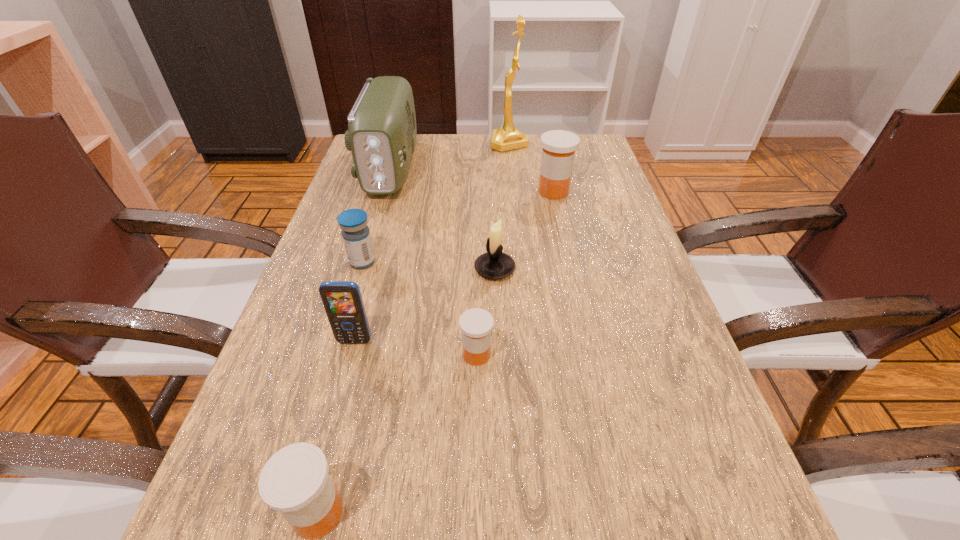
The image size is (960, 540). Identify the location of vacant space located on the label of the smallest orange medicine. (651, 355).

Where is `award that is at the far edge`? award that is at the far edge is located at coordinates (507, 137).

Locate an element on the screen. Image resolution: width=960 pixels, height=540 pixels. radio_receiver positioned at the far edge is located at coordinates (381, 135).

Locate an element on the screen. radio_receiver at the left edge is located at coordinates (381, 135).

In order to click on cellular telephone at the left edge in this screenshot , I will do `click(342, 300)`.

Identify the location of medicine situated at the left edge. (355, 232).

The width and height of the screenshot is (960, 540). In order to click on object that is at the right edge in this screenshot , I will do `click(558, 146)`.

Locate an element on the screen. object that is at the far left corner is located at coordinates (381, 135).

This screenshot has height=540, width=960. Identify the location of vacant space at the far edge. (480, 172).

You are a GUI agent. You are given a task and a screenshot of the screen. Output one action in this format:
    pyautogui.click(x=<x>, y=<y>)
    Task: Click on the free space at the left edge of the desktop
    This screenshot has width=960, height=540.
    Given the screenshot: What is the action you would take?
    pyautogui.click(x=311, y=377)